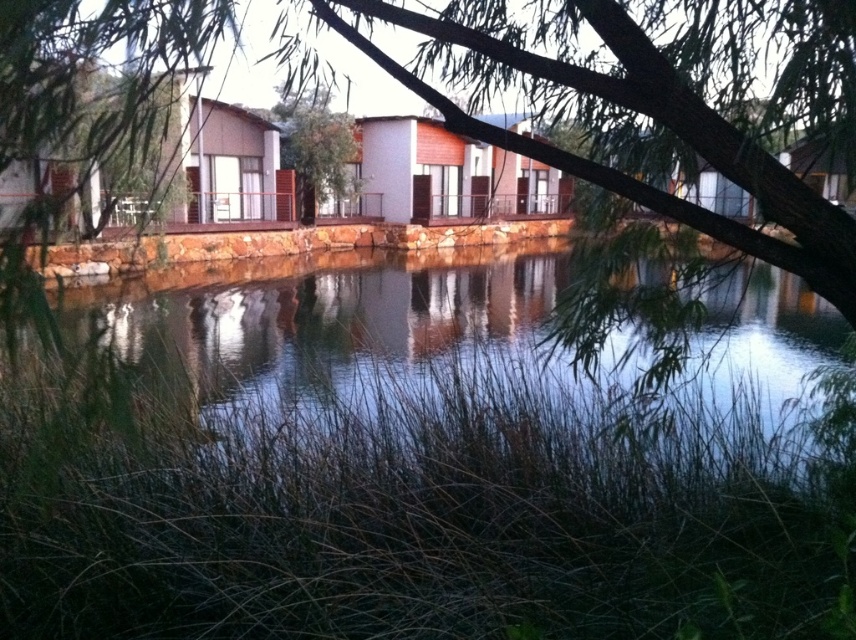
You are standing at the lakeside and want to cross to the other side. You see the green grassy river at center and the green leafy tree at center. Which one is wider?

The green grassy river at center might be wider than green leafy tree at center according to the description.

You are standing at the lakeside and want to take a photo of both the green grassy river at center and the green leafy tree at center. Which object appears taller in the photo?

The green grassy river at center appears taller than the green leafy tree at center in the photo.

You are standing at the lakeside and want to take a photo of the green grassy river at center and the green leafy tree at center. Which object should you focus on first to ensure both are in sharp focus?

You should focus on the green leafy tree at center first because it is farther away from the viewer than the green grassy river at center, ensuring both are in focus when using a camera with a fixed focal point.